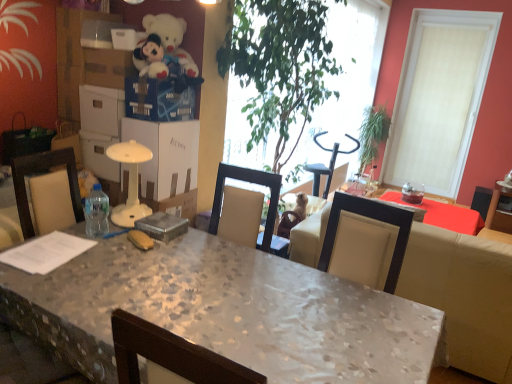
What are the coordinates of `unoccupied area behind clear plastic bottle at table left` in the screenshot? It's located at (121, 218).